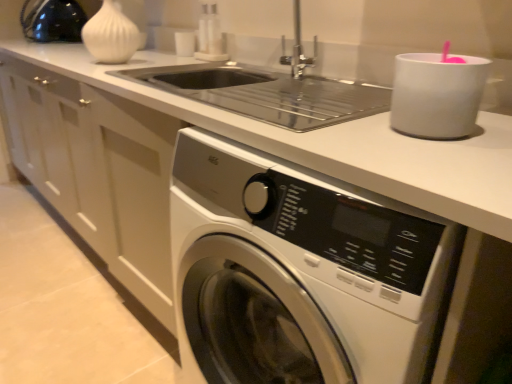
Question: Can you confirm if white matte cup at upper right, the first appliance in the bottom-to-top sequence, is shorter than white matte vase at upper left?

Choices:
 (A) no
 (B) yes

Answer: (B)

Question: From the image's perspective, is white matte cup at upper right, the first appliance in the bottom-to-top sequence, on top of white matte vase at upper left?

Choices:
 (A) yes
 (B) no

Answer: (B)

Question: Does white matte cup at upper right, which is the 2th appliance from left to right, appear on the right side of white matte vase at upper left?

Choices:
 (A) no
 (B) yes

Answer: (B)

Question: Is white matte cup at upper right, which is counted as the 1th appliance, starting from the right, far from white matte vase at upper left?

Choices:
 (A) no
 (B) yes

Answer: (B)

Question: Does white matte cup at upper right, the first appliance from the front, touch white matte vase at upper left?

Choices:
 (A) yes
 (B) no

Answer: (B)

Question: Is point (119, 59) closer or farther from the camera than point (417, 380)?

Choices:
 (A) closer
 (B) farther

Answer: (B)

Question: From the image's perspective, is white matte vase at upper left located above or below white glossy washing machine at lower center?

Choices:
 (A) below
 (B) above

Answer: (B)

Question: From a real-world perspective, is white matte vase at upper left above or below white glossy washing machine at lower center?

Choices:
 (A) above
 (B) below

Answer: (A)

Question: Looking at their shapes, would you say white matte vase at upper left is wider or thinner than white glossy washing machine at lower center?

Choices:
 (A) wide
 (B) thin

Answer: (B)

Question: Is white matte cup at upper right, the first appliance from the front, situated inside white glossy washing machine at lower center or outside?

Choices:
 (A) inside
 (B) outside

Answer: (B)

Question: Would you say white matte cup at upper right, the first appliance in the bottom-to-top sequence, is to the left or to the right of white glossy washing machine at lower center in the picture?

Choices:
 (A) right
 (B) left

Answer: (A)

Question: Relative to white glossy washing machine at lower center, is white matte cup at upper right, the first appliance in the bottom-to-top sequence, in front or behind?

Choices:
 (A) front
 (B) behind

Answer: (B)

Question: From their relative heights in the image, would you say white matte cup at upper right, which is the 2th appliance from left to right, is taller or shorter than white glossy washing machine at lower center?

Choices:
 (A) tall
 (B) short

Answer: (B)

Question: Considering the positions of matte black kettle at upper left, which ranks as the first appliance in left-to-right order, and white matte cup at upper right, the 2th appliance from the top, in the image, is matte black kettle at upper left, which ranks as the first appliance in left-to-right order, bigger or smaller than white matte cup at upper right, the 2th appliance from the top,?

Choices:
 (A) small
 (B) big

Answer: (B)

Question: Based on their positions, is matte black kettle at upper left, which appears as the first appliance when viewed from the top, located to the left or right of white matte cup at upper right, positioned as the second appliance in back-to-front order?

Choices:
 (A) left
 (B) right

Answer: (A)